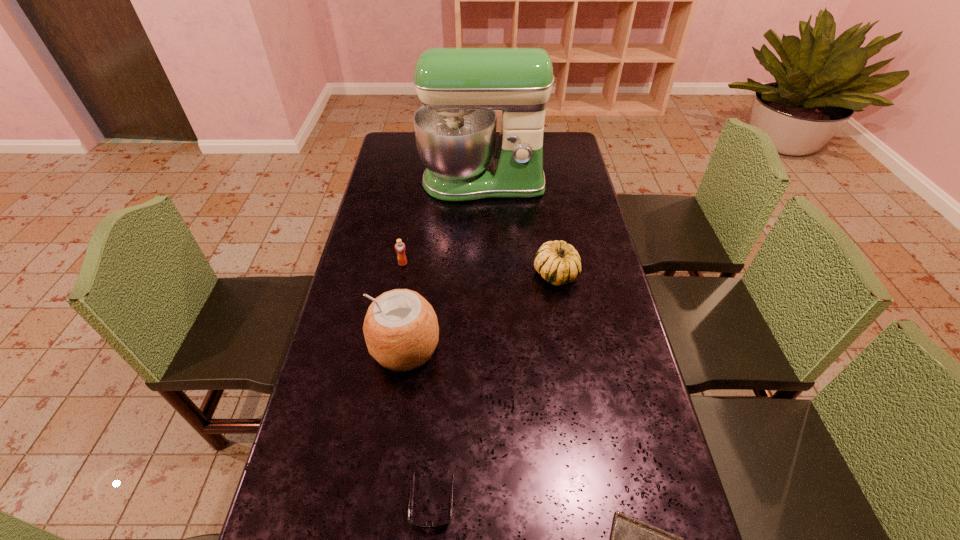
Find the location of a particular element. free region located on the right of the orange juice is located at coordinates (492, 264).

Locate an element on the screen. coconut that is at the left edge is located at coordinates pos(401,331).

Image resolution: width=960 pixels, height=540 pixels. What are the coordinates of `orange juice located at the left edge` in the screenshot? It's located at (400, 248).

Locate an element on the screen. mixer positioned at the right edge is located at coordinates (460, 88).

Identify the location of gourd that is positioned at the right edge. (559, 263).

Find the location of a particular element. Image resolution: width=960 pixels, height=540 pixels. vacant area at the left edge of the desktop is located at coordinates 389,240.

Locate an element on the screen. The height and width of the screenshot is (540, 960). free space at the right edge is located at coordinates (568, 163).

Where is `vacant region at the far left corner of the desktop`? The image size is (960, 540). vacant region at the far left corner of the desktop is located at coordinates (x=390, y=151).

Find the location of a particular element. This screenshot has width=960, height=540. vacant point located between the fourth tallest object and the gourd is located at coordinates (479, 269).

Where is `unoccupied area between the gourd and the fourth farthest object`? unoccupied area between the gourd and the fourth farthest object is located at coordinates (480, 311).